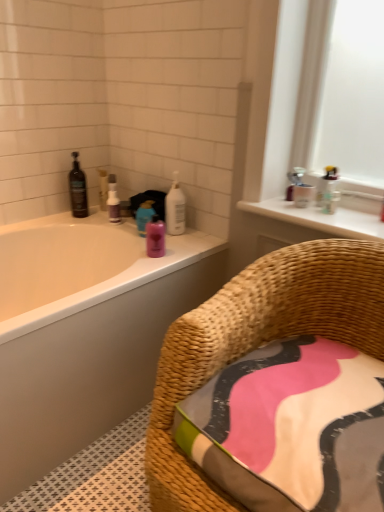
Find the location of a particular element. vacant space behind pink glossy bottle at upper center, acting as the 2th toiletry starting from the top is located at coordinates (174, 240).